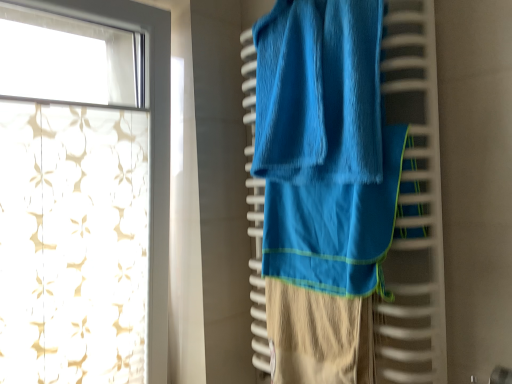
Question: Is white sheer curtain at upper left oriented towards blue soft towel at center?

Choices:
 (A) no
 (B) yes

Answer: (B)

Question: From the image's perspective, is white sheer curtain at upper left located beneath blue soft towel at center?

Choices:
 (A) yes
 (B) no

Answer: (A)

Question: Is white sheer curtain at upper left behind blue soft towel at center?

Choices:
 (A) yes
 (B) no

Answer: (A)

Question: Can you confirm if white sheer curtain at upper left is taller than blue soft towel at center?

Choices:
 (A) yes
 (B) no

Answer: (A)

Question: From the image's perspective, is white sheer curtain at upper left on blue soft towel at center?

Choices:
 (A) no
 (B) yes

Answer: (A)

Question: Would you say white sheer curtain at upper left is outside blue soft towel at center?

Choices:
 (A) yes
 (B) no

Answer: (A)

Question: From a real-world perspective, is blue soft towel at center on top of white sheer curtain at upper left?

Choices:
 (A) yes
 (B) no

Answer: (B)

Question: Is the position of blue soft towel at center more distant than that of white sheer curtain at upper left?

Choices:
 (A) no
 (B) yes

Answer: (A)

Question: Is blue soft towel at center thinner than white sheer curtain at upper left?

Choices:
 (A) yes
 (B) no

Answer: (A)

Question: From a real-world perspective, does blue soft towel at center sit lower than white sheer curtain at upper left?

Choices:
 (A) yes
 (B) no

Answer: (A)

Question: Is blue soft towel at center not near white sheer curtain at upper left?

Choices:
 (A) yes
 (B) no

Answer: (B)

Question: Is blue soft towel at center outside of white sheer curtain at upper left?

Choices:
 (A) yes
 (B) no

Answer: (A)

Question: Considering the relative positions of white sheer curtain at upper left and blue soft towel at center in the image provided, is white sheer curtain at upper left to the left or to the right of blue soft towel at center?

Choices:
 (A) left
 (B) right

Answer: (A)